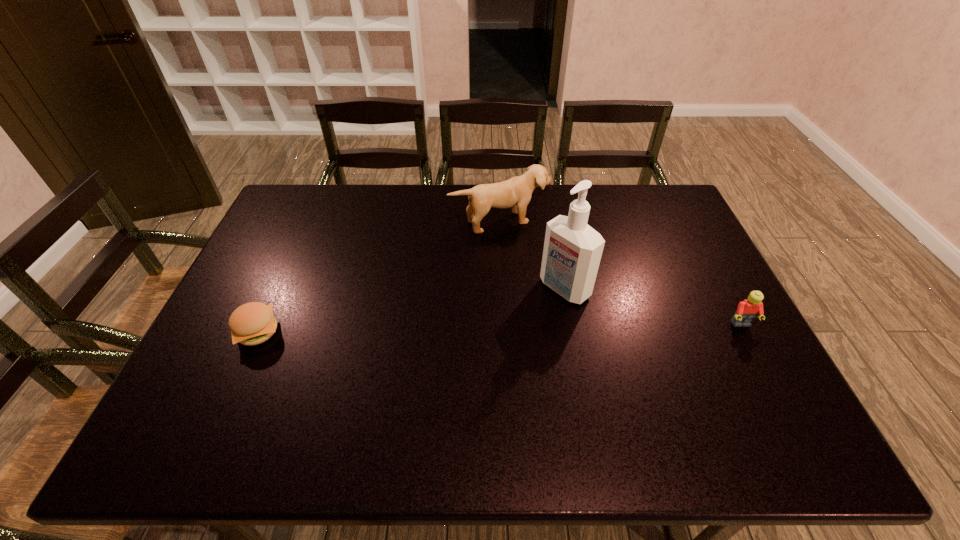
In order to click on vacant space that is in between the rightmost object and the second tallest object in this screenshot , I will do `click(621, 273)`.

Where is `blank region between the farthest object and the tallest object`? blank region between the farthest object and the tallest object is located at coordinates (533, 254).

This screenshot has height=540, width=960. Identify the location of unoccupied position between the leftmost object and the farthest object. (379, 276).

The height and width of the screenshot is (540, 960). Identify the location of empty space between the second tallest object and the shortest object. (379, 276).

Select which object is the third closest to the Lego. Please provide its 2D coordinates. Your answer should be formatted as a tuple, i.e. [(x, y)], where the tuple contains the x and y coordinates of a point satisfying the conditions above.

[(253, 323)]

Identify the location of object that is the third closest to the farthest object. Image resolution: width=960 pixels, height=540 pixels. (747, 310).

Identify the location of free space that satisfies the following two spatial constraints: 1. on the front side of the tallest object; 2. on the right side of the farthest object. This screenshot has height=540, width=960. (505, 288).

The width and height of the screenshot is (960, 540). I want to click on free location that satisfies the following two spatial constraints: 1. on the back side of the farthest object; 2. on the left side of the shortest object, so click(307, 220).

You are a GUI agent. You are given a task and a screenshot of the screen. Output one action in this format:
    pyautogui.click(x=<x>, y=<y>)
    Task: Click on the free space that satisfies the following two spatial constraints: 1. on the back side of the leftmost object; 2. on the left side of the second farthest object
    The width and height of the screenshot is (960, 540).
    Given the screenshot: What is the action you would take?
    pyautogui.click(x=277, y=288)